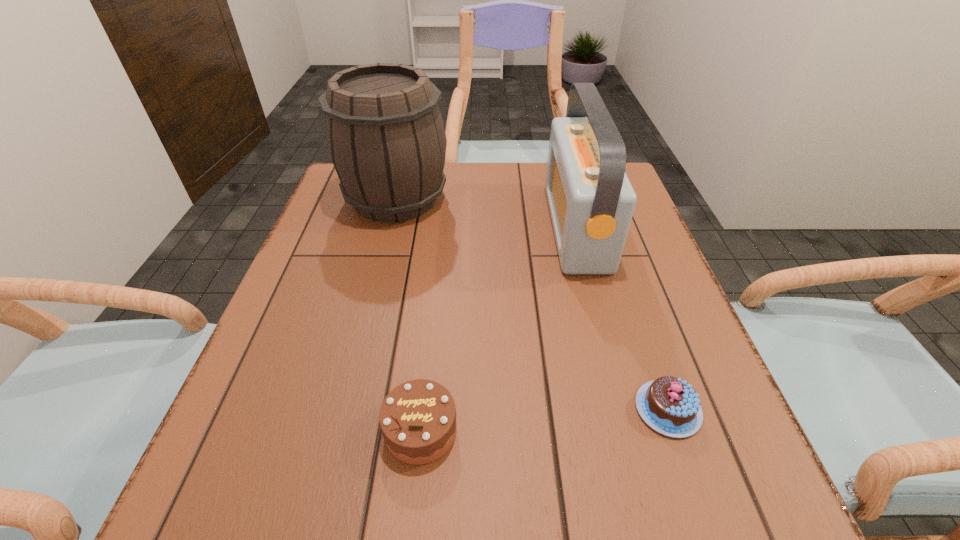
What are the coordinates of `vacant position at the near edge of the desktop` in the screenshot? It's located at tap(470, 507).

Locate an element on the screen. vacant space at the left edge is located at coordinates (226, 449).

Find the location of a particular element. The image size is (960, 540). vacant space at the right edge of the desktop is located at coordinates 715,384.

Locate an element on the screen. This screenshot has width=960, height=540. free space at the near right corner of the desktop is located at coordinates (714, 491).

You are a GUI agent. You are given a task and a screenshot of the screen. Output one action in this format:
    pyautogui.click(x=<x>, y=<y>)
    Task: Click on the blank region between the shortest object and the radio receiver
    The image size is (960, 540).
    Given the screenshot: What is the action you would take?
    pyautogui.click(x=622, y=318)

You are a GUI agent. You are given a task and a screenshot of the screen. Output one action in this format:
    pyautogui.click(x=<x>, y=<y>)
    Task: Click on the empty space between the shorter chocolate cake and the taller chocolate cake
    The height and width of the screenshot is (540, 960).
    Given the screenshot: What is the action you would take?
    pyautogui.click(x=544, y=420)

You are a GUI agent. You are given a task and a screenshot of the screen. Output one action in this format:
    pyautogui.click(x=<x>, y=<y>)
    Task: Click on the free space between the wine bucket and the second shortest object
    
    Given the screenshot: What is the action you would take?
    pyautogui.click(x=408, y=315)

Image resolution: width=960 pixels, height=540 pixels. Identify the location of free space between the radio receiver and the shortest object. (622, 318).

What are the coordinates of `empty space that is in between the left chocolate cake and the radio receiver` in the screenshot? It's located at (498, 328).

You are a GUI agent. You are given a task and a screenshot of the screen. Output one action in this format:
    pyautogui.click(x=<x>, y=<y>)
    Task: Click on the free spot between the radio receiver and the shortest object
    This screenshot has width=960, height=540.
    Given the screenshot: What is the action you would take?
    [x=622, y=318]